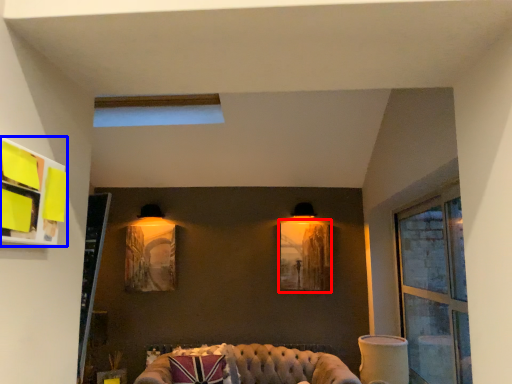
Question: Which of the following is the farthest to the observer, picture frame (highlighted by a red box) or shelf (highlighted by a blue box)?

Choices:
 (A) picture frame
 (B) shelf

Answer: (A)